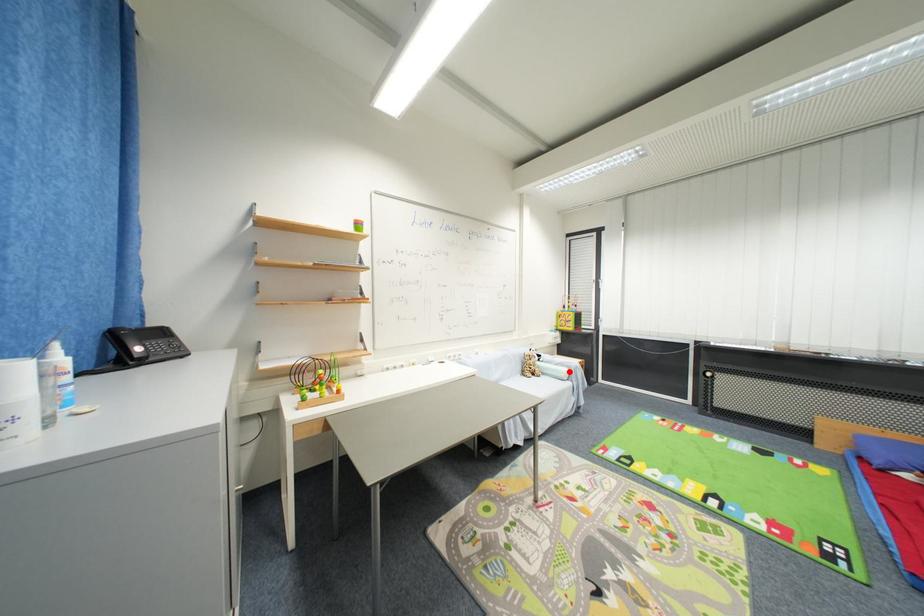
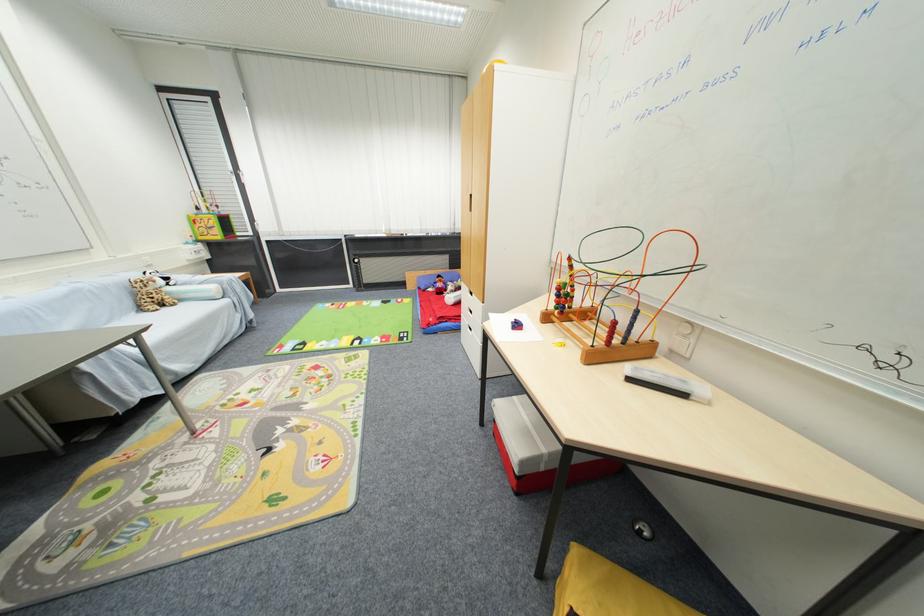
Question: I am providing you with two images of the same scene from different viewpoints. A red point is shown in image1. For the corresponding object point in image2, is it positioned nearer or farther from the camera?

Choices:
 (A) Nearer
 (B) Farther

Answer: (A)